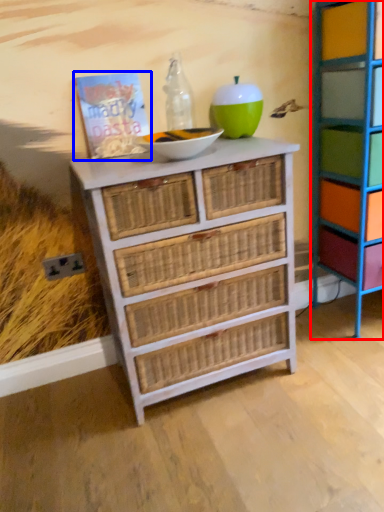
Question: Which object is further to the camera taking this photo, shelf (highlighted by a red box) or book (highlighted by a blue box)?

Choices:
 (A) shelf
 (B) book

Answer: (B)